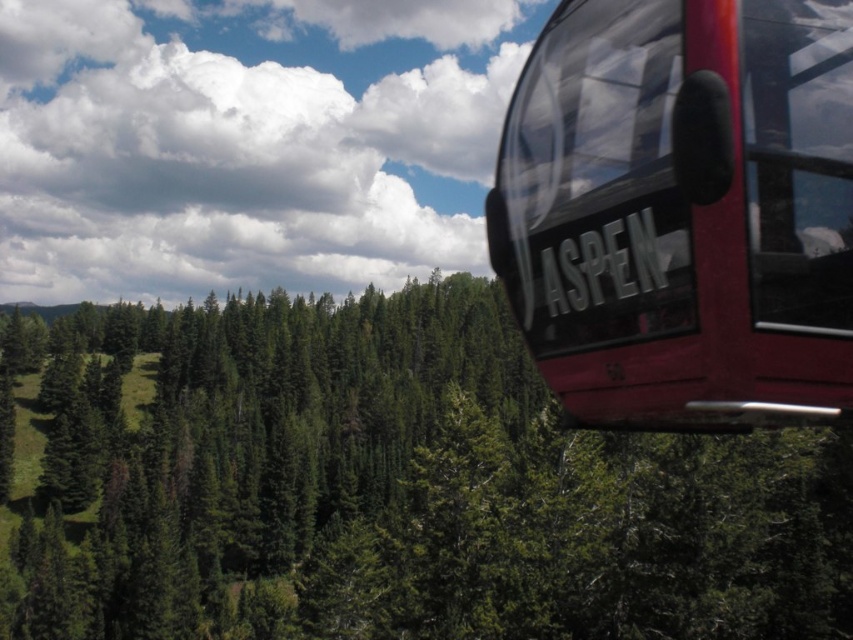
You are a passenger in the shiny red cable car at upper right and want to know how far the green matte tree at upper center is from your current position. Can you determine the distance?

The distance between the green matte tree at upper center and the shiny red cable car at upper right is 106.67 meters.

You are a passenger in the shiny red cable car at upper right and want to take a photo of the green matte tree at upper center through the window. Will the tree be fully visible in your photo?

The shiny red cable car at upper right is behind the green matte tree at upper center, so the tree will block the view of the car, but since you are inside the car, the tree would be in the foreground of your photo. However, the question is about the tree being fully visible. Since the tree is in front of the car, you might be able to see most of it unless obstructed by the car structure. But according to the description, the car is at upper right and the tree at upper center, so the tree might partially or

You are inside the Aspen gondola and looking out the window. There is a point marked at coordinates (384,486) on the window. What object is located at that point?

The point at coordinates (384,486) corresponds to the green matte tree at upper center.